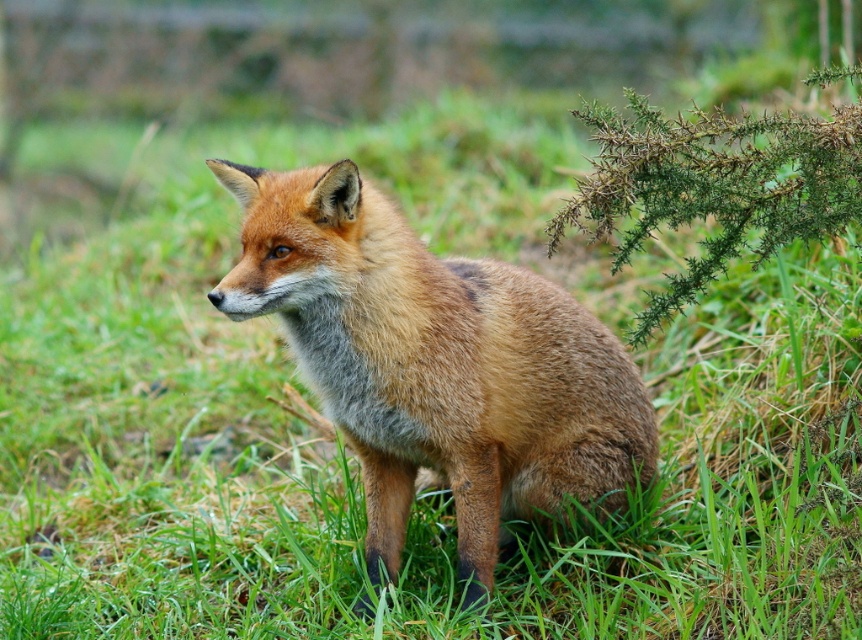
Is the position of shiny orange fur fox at center less distant than that of green spiky plant at upper right?

No, it is not.

Is shiny orange fur fox at center wider than green spiky plant at upper right?

Yes.

Is point (578, 499) farther from camera compared to point (623, 243)?

Yes.

Where is `shiny orange fur fox at center`? The height and width of the screenshot is (640, 862). shiny orange fur fox at center is located at coordinates (435, 364).